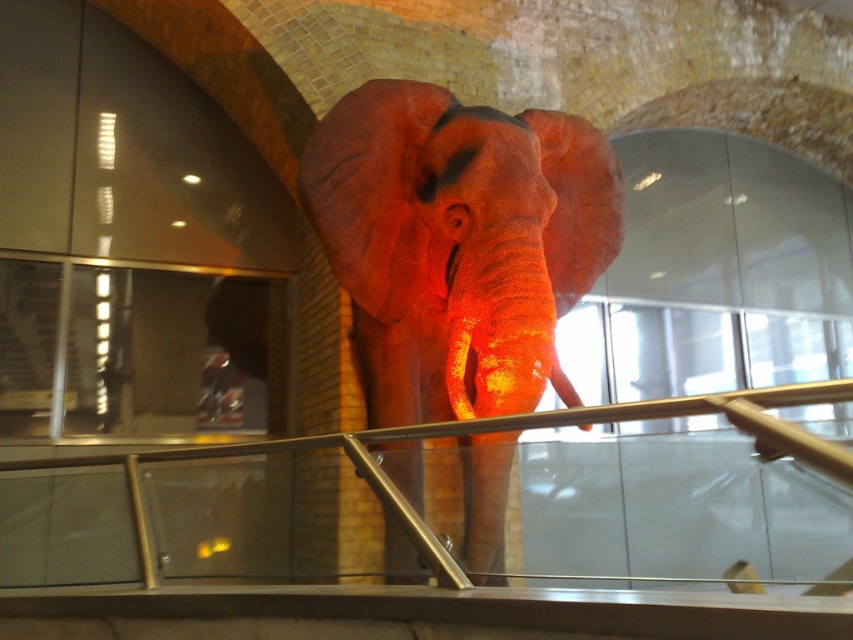
Based on the photo, which is more to the right, shiny orange elephant at center or matte orange tusk at center?

From the viewer's perspective, matte orange tusk at center appears more on the right side.

Between point (398, 220) and point (567, 384), which one is positioned behind?

The point (567, 384) is behind.

This screenshot has width=853, height=640. What do you see at coordinates (457, 243) in the screenshot?
I see `shiny orange elephant at center` at bounding box center [457, 243].

You are a GUI agent. You are given a task and a screenshot of the screen. Output one action in this format:
    pyautogui.click(x=<x>, y=<y>)
    Task: Click on the shiny orange elephant at center
    This screenshot has width=853, height=640.
    Given the screenshot: What is the action you would take?
    pyautogui.click(x=457, y=243)